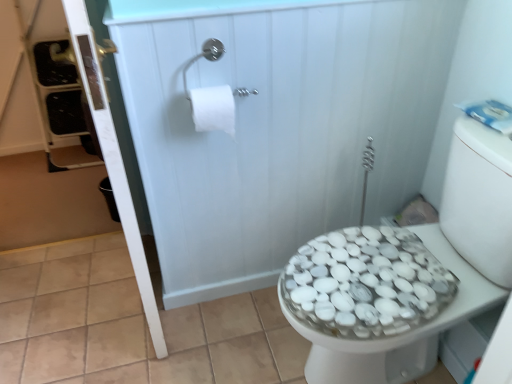
Question: Is white glossy shower door at upper left inside or outside of white matte toilet paper at upper center?

Choices:
 (A) inside
 (B) outside

Answer: (B)

Question: From the image's perspective, is white glossy shower door at upper left above or below white matte toilet paper at upper center?

Choices:
 (A) above
 (B) below

Answer: (B)

Question: Based on their relative distances, which object is farther from the white matte toilet paper at upper center?

Choices:
 (A) white pebble-patterned bidet at right
 (B) white glossy shower door at upper left

Answer: (A)

Question: Considering the real-world distances, which object is closest to the white pebble-patterned bidet at right?

Choices:
 (A) white glossy shower door at upper left
 (B) white matte toilet paper at upper center

Answer: (A)